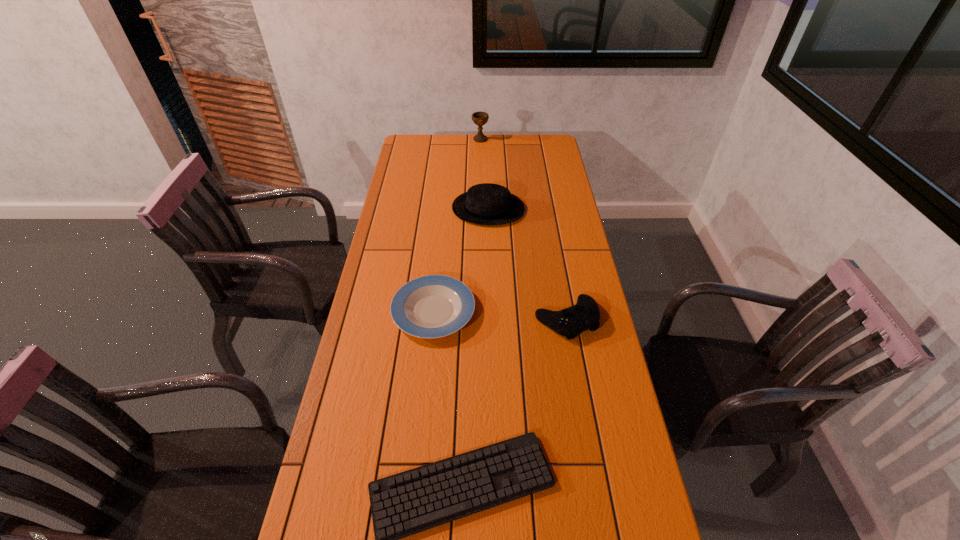
Locate an element on the screen. The image size is (960, 540). the tallest object is located at coordinates (480, 118).

The image size is (960, 540). In order to click on chalice in this screenshot , I will do (480, 118).

Identify the location of the second farthest object. (484, 204).

Locate an element on the screen. the fourth shortest object is located at coordinates point(484,204).

I want to click on the third shortest object, so click(x=584, y=315).

Identify the location of plate. Image resolution: width=960 pixels, height=540 pixels. (433, 306).

Identify the location of vacant area situated on the left of the farthest object. This screenshot has height=540, width=960. (432, 139).

Image resolution: width=960 pixels, height=540 pixels. In order to click on free location located on the right of the fourth nearest object in this screenshot , I will do click(563, 209).

Image resolution: width=960 pixels, height=540 pixels. Find the location of `free space located 0.280m on the front of the control`. free space located 0.280m on the front of the control is located at coordinates (586, 431).

Where is `vacant area situated on the front of the fourth tallest object`? vacant area situated on the front of the fourth tallest object is located at coordinates pyautogui.click(x=426, y=389).